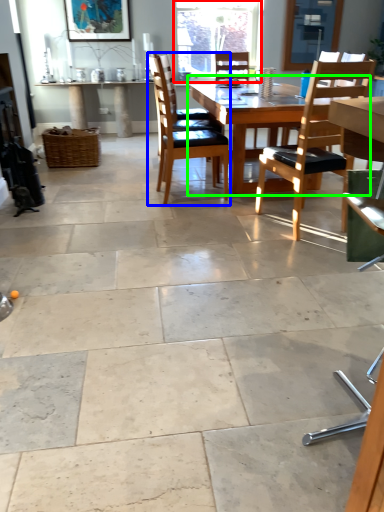
Question: Which is farther away from window (highlighted by a red box)? chair (highlighted by a blue box) or kitchen & dining room table (highlighted by a green box)?

Choices:
 (A) chair
 (B) kitchen & dining room table

Answer: (B)